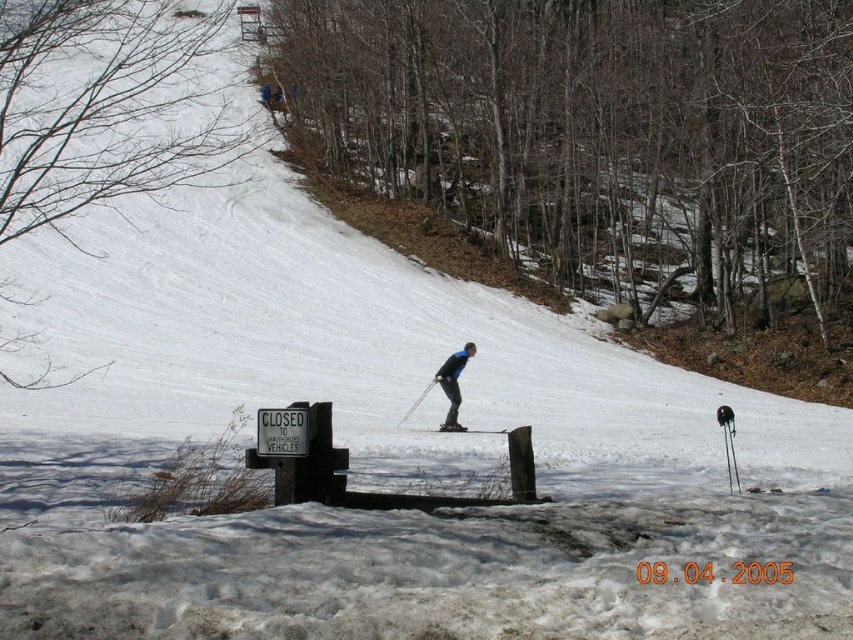
Identify the location of blue fabric snowsuit at center. (450, 387).

Between point (447, 371) and point (445, 428), which one is positioned in front?

Point (445, 428) is in front.

Locate an element on the screen. The width and height of the screenshot is (853, 640). blue fabric snowsuit at center is located at coordinates 450,387.

Is blue fabric snowsuit at center behind blue matte skier at center?

No, it is in front of blue matte skier at center.

Is blue fabric snowsuit at center above blue matte skier at center?

Incorrect, blue fabric snowsuit at center is not positioned above blue matte skier at center.

What are the coordinates of `blue fabric snowsuit at center` in the screenshot? It's located at (450, 387).

Locate an element on the screen. blue fabric snowsuit at center is located at coordinates (450, 387).

Can you confirm if blue matte skier at center is positioned to the left of black matte ski at center?

Indeed, blue matte skier at center is positioned on the left side of black matte ski at center.

Which is above, blue matte skier at center or black matte ski at center?

blue matte skier at center is higher up.

Between point (445, 392) and point (426, 428), which one is positioned behind?

Positioned behind is point (426, 428).

The image size is (853, 640). What are the coordinates of `blue matte skier at center` in the screenshot? It's located at (453, 385).